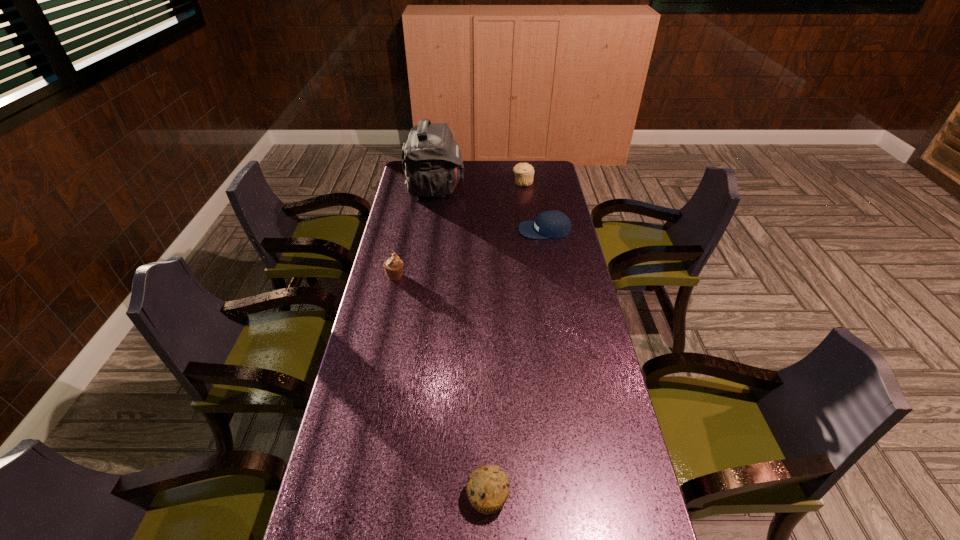
This screenshot has width=960, height=540. Identify the location of vacant space located 0.240m on the front-facing side of the third farthest object. (460, 230).

The height and width of the screenshot is (540, 960). Find the location of `vacant space located 0.270m on the front-facing side of the third farthest object`. vacant space located 0.270m on the front-facing side of the third farthest object is located at coordinates (453, 230).

Where is `vacant space located 0.100m on the front-facing side of the third farthest object`? This screenshot has width=960, height=540. vacant space located 0.100m on the front-facing side of the third farthest object is located at coordinates (494, 230).

Locate an element on the screen. Image resolution: width=960 pixels, height=540 pixels. vacant position located on the right of the third object from left to right is located at coordinates (572, 496).

Locate an element on the screen. The height and width of the screenshot is (540, 960). shoulder bag located at the far edge is located at coordinates (432, 161).

Find the location of a particular element. muffin present at the far edge is located at coordinates (524, 172).

This screenshot has height=540, width=960. I want to click on shoulder bag that is positioned at the left edge, so click(x=432, y=161).

Find the location of a particular element. muffin that is at the left edge is located at coordinates (393, 266).

Locate an element on the screen. This screenshot has height=540, width=960. muffin that is at the right edge is located at coordinates (524, 172).

This screenshot has width=960, height=540. In order to click on baseball cap at the right edge in this screenshot , I will do `click(554, 224)`.